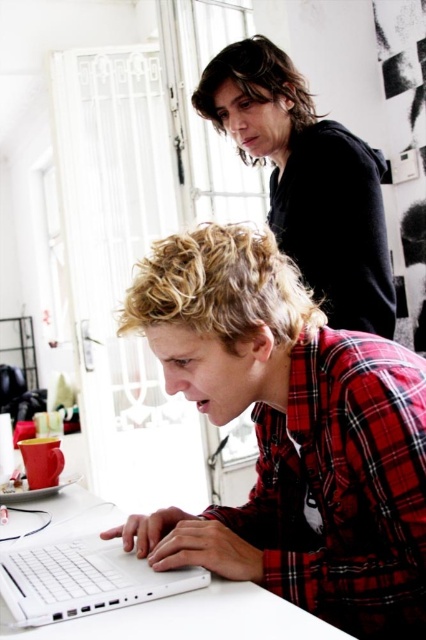
Between red plaid shirt at center and white matte laptop at lower left, which one is positioned higher?

red plaid shirt at center is above.

Can you confirm if red plaid shirt at center is bigger than white matte laptop at lower left?

Yes, red plaid shirt at center is bigger than white matte laptop at lower left.

Identify the location of red plaid shirt at center. (290, 435).

Who is shorter, red plaid shirt at center or black hoodie at upper center?

With less height is red plaid shirt at center.

Is red plaid shirt at center thinner than black hoodie at upper center?

Yes, red plaid shirt at center is thinner than black hoodie at upper center.

Describe the element at coordinates (290, 435) in the screenshot. This screenshot has height=640, width=426. I see `red plaid shirt at center` at that location.

At what (x,y) coordinates should I click in order to perform the action: click on red plaid shirt at center. Please return your answer as a coordinate pair (x, y). The image size is (426, 640). Looking at the image, I should click on (290, 435).

In the scene shown: Between black hoodie at upper center and white matte laptop at lower left, which one appears on the left side from the viewer's perspective?

Positioned to the left is white matte laptop at lower left.

Does black hoodie at upper center have a greater width compared to white matte laptop at lower left?

Indeed, black hoodie at upper center has a greater width compared to white matte laptop at lower left.

Which is behind, point (218, 88) or point (51, 548)?

Positioned behind is point (218, 88).

The width and height of the screenshot is (426, 640). What are the coordinates of `black hoodie at upper center` in the screenshot? It's located at (307, 180).